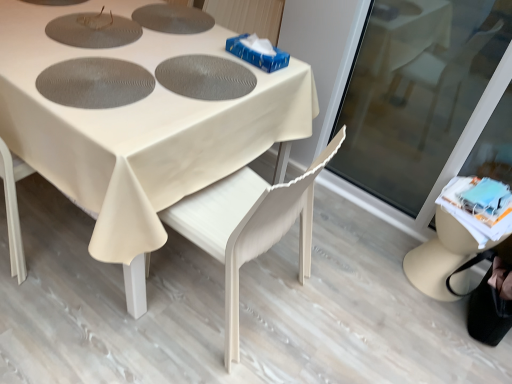
Question: Visually, is transparent glass screen door at lower right positioned to the left or to the right of white wood chair at center?

Choices:
 (A) left
 (B) right

Answer: (B)

Question: Is transparent glass screen door at lower right taller or shorter than white wood chair at center?

Choices:
 (A) tall
 (B) short

Answer: (A)

Question: Estimate the real-world distances between objects in this image. Which object is closer to the transparent glass screen door at lower right?

Choices:
 (A) white wood chair at center
 (B) white fabric table at center

Answer: (A)

Question: Based on their relative distances, which object is farther from the white wood chair at center?

Choices:
 (A) white fabric table at center
 (B) transparent glass screen door at lower right

Answer: (B)